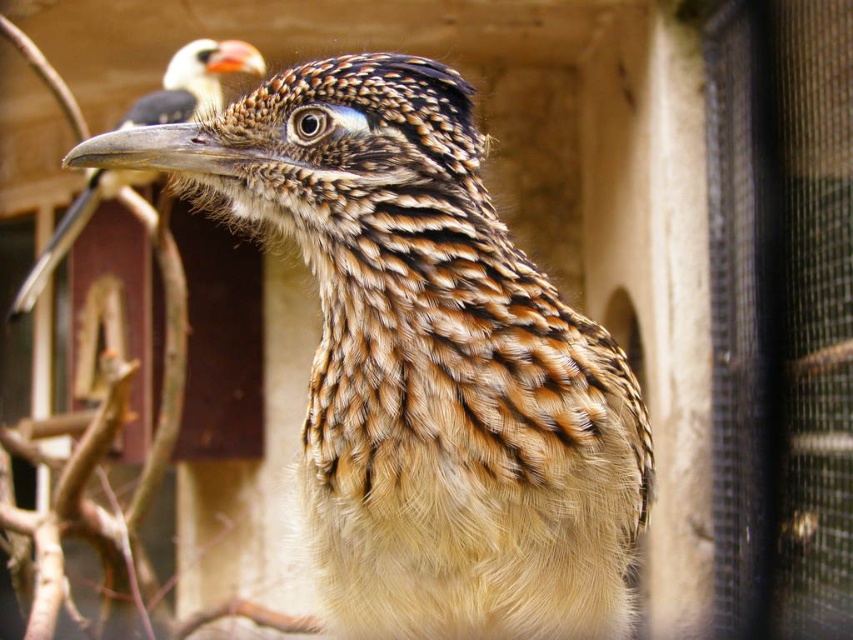
Does brown speckled feathers at center have a lesser width compared to speckled feathered bird at upper left?

Correct, brown speckled feathers at center's width is less than speckled feathered bird at upper left's.

Is brown speckled feathers at center taller than speckled feathered bird at upper left?

No.

Is point (257, 116) positioned in front of point (39, 276)?

Yes, point (257, 116) is closer to viewer.

This screenshot has width=853, height=640. I want to click on brown speckled feathers at center, so click(x=426, y=360).